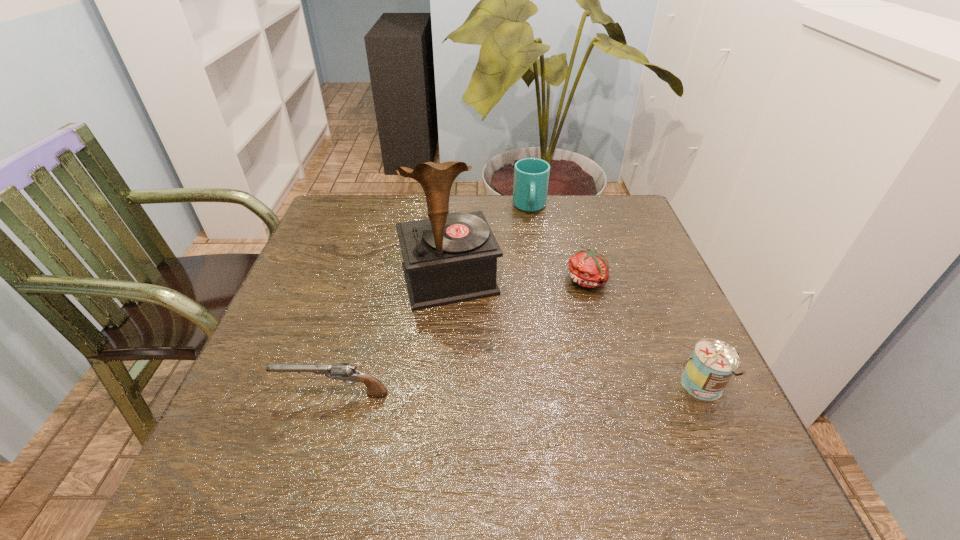
This screenshot has width=960, height=540. Find the location of `vacant space located on the front-facing side of the fourth object from left to right`. vacant space located on the front-facing side of the fourth object from left to right is located at coordinates (565, 369).

Find the location of a particular element. The height and width of the screenshot is (540, 960). vacant space situated 0.330m on the handle side of the cup is located at coordinates (539, 299).

Identify the location of vacant space situated on the handle side of the cup. (539, 293).

The width and height of the screenshot is (960, 540). I want to click on vacant area situated 0.290m on the handle side of the cup, so click(x=538, y=287).

The height and width of the screenshot is (540, 960). Identify the location of free space located 0.050m at the horn opening of the phonograph_record. (467, 327).

Identify the location of free space located 0.070m at the horn opening of the phonograph_record. Image resolution: width=960 pixels, height=540 pixels. (468, 334).

Locate an element on the screen. vacant space located at the horn opening of the phonograph_record is located at coordinates (499, 424).

The width and height of the screenshot is (960, 540). What are the coordinates of `object located at the far edge` in the screenshot? It's located at (531, 175).

Identify the location of gun present at the near edge. (341, 371).

The height and width of the screenshot is (540, 960). What are the coordinates of `can located at the near edge` in the screenshot? It's located at (709, 369).